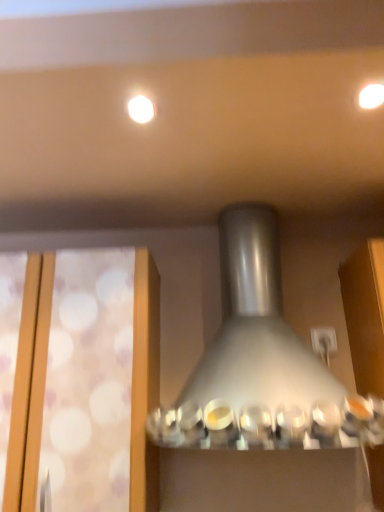
Question: Based on their positions, is translucent frosted glass at left located to the left or right of white glossy light fixture at upper center, the second lighting in the right-to-left sequence?

Choices:
 (A) left
 (B) right

Answer: (A)

Question: From the image's perspective, is translucent frosted glass at left above or below white glossy light fixture at upper center, the second lighting in the right-to-left sequence?

Choices:
 (A) below
 (B) above

Answer: (A)

Question: Estimate the real-world distances between objects in this image. Which object is closer to the matte white light at upper right, the second lighting from the left?

Choices:
 (A) white glossy light fixture at upper center, which is the 1th lighting from left to right
 (B) satin silver lamp at center
 (C) translucent frosted glass at left

Answer: (A)

Question: Based on their relative distances, which object is nearer to the satin silver lamp at center?

Choices:
 (A) white glossy light fixture at upper center, the second lighting in the right-to-left sequence
 (B) translucent frosted glass at left
 (C) matte white light at upper right, which is the 1th lighting in right-to-left order

Answer: (B)